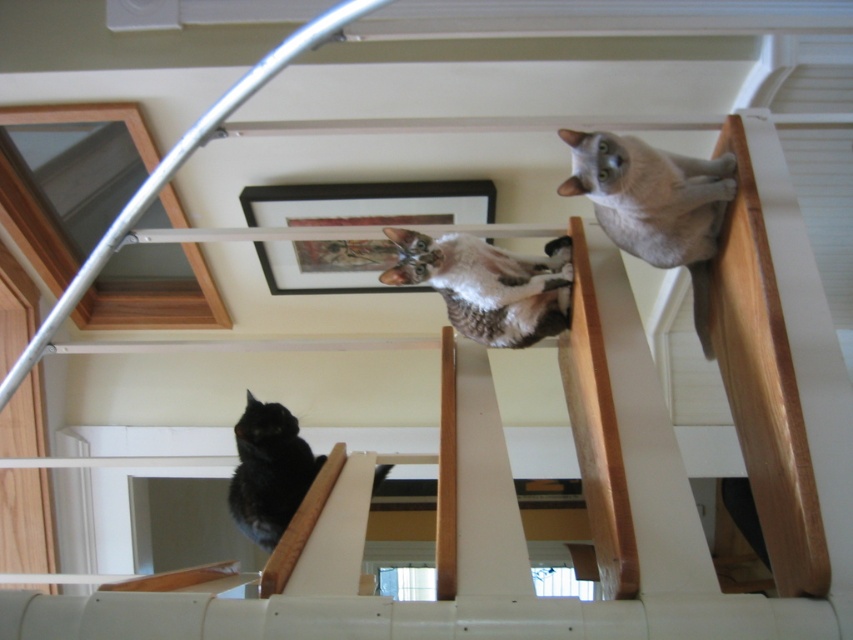
Question: Is silvery gray fur at upper right behind black fur cat at lower left?

Choices:
 (A) no
 (B) yes

Answer: (A)

Question: Is tabby fur cat at center to the right of black fur cat at lower left from the viewer's perspective?

Choices:
 (A) no
 (B) yes

Answer: (B)

Question: Which object is closer to the camera taking this photo?

Choices:
 (A) black fur cat at lower left
 (B) tabby fur cat at center
 (C) silvery gray fur at upper right

Answer: (C)

Question: Which object is farther from the camera taking this photo?

Choices:
 (A) silvery gray fur at upper right
 (B) black fur cat at lower left
 (C) tabby fur cat at center

Answer: (B)

Question: Can you confirm if silvery gray fur at upper right is positioned below black fur cat at lower left?

Choices:
 (A) yes
 (B) no

Answer: (B)

Question: Among these points, which one is nearest to the camera?

Choices:
 (A) (262, 513)
 (B) (618, 230)
 (C) (436, 248)

Answer: (B)